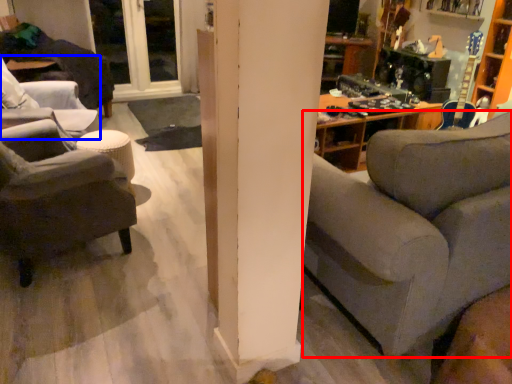
Question: Which object appears closest to the camera in this image, studio couch (highlighted by a red box) or chair (highlighted by a blue box)?

Choices:
 (A) studio couch
 (B) chair

Answer: (A)